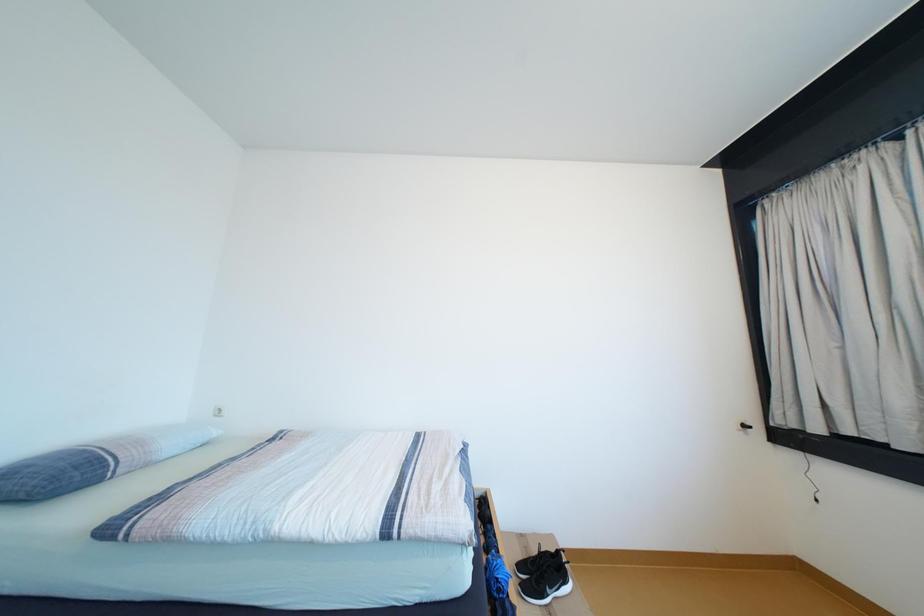
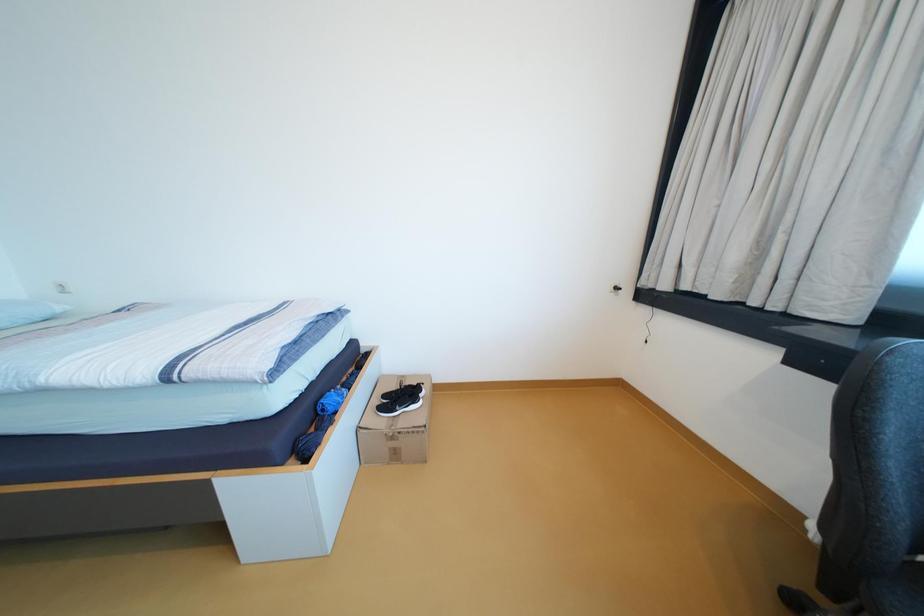
Question: How did the camera likely rotate?

Choices:
 (A) Left
 (B) Right
 (C) Up
 (D) Down

Answer: (D)